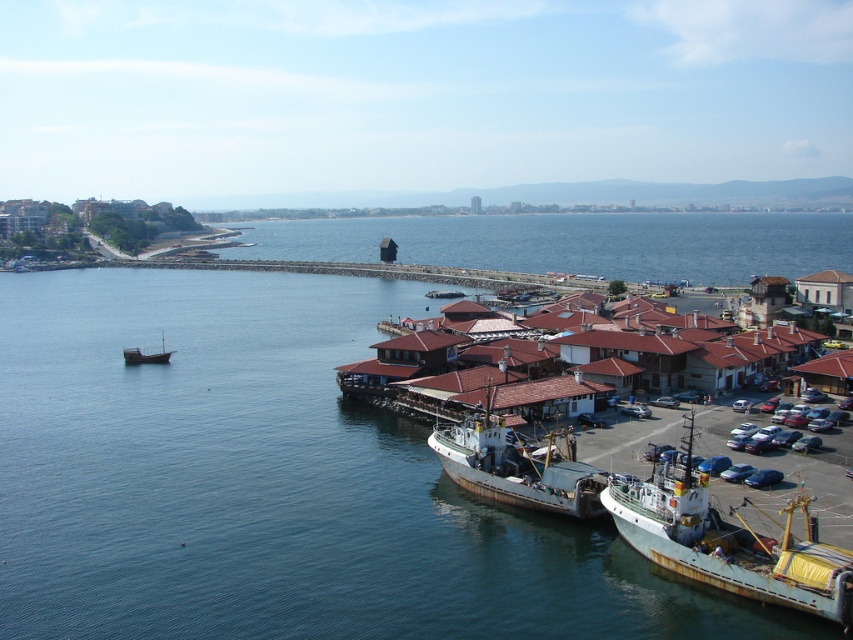
Is blue water at center to the left of rusty metal fishing boat at lower center from the viewer's perspective?

Correct, you'll find blue water at center to the left of rusty metal fishing boat at lower center.

The image size is (853, 640). Describe the element at coordinates (273, 483) in the screenshot. I see `blue water at center` at that location.

Does point (134, 563) come closer to viewer compared to point (456, 440)?

Yes, point (134, 563) is closer to viewer.

The image size is (853, 640). Identify the location of blue water at center. (273, 483).

Between rusty metal ship at lower right and wooden boat at left, which one is positioned higher?

wooden boat at left is above.

The width and height of the screenshot is (853, 640). I want to click on rusty metal ship at lower right, so click(730, 545).

Locate an element on the screen. The height and width of the screenshot is (640, 853). rusty metal ship at lower right is located at coordinates (730, 545).

Is blue water at center bigger than wooden boat at left?

Yes, blue water at center is bigger than wooden boat at left.

Can you confirm if blue water at center is positioned to the right of wooden boat at left?

Yes, blue water at center is to the right of wooden boat at left.

This screenshot has height=640, width=853. I want to click on blue water at center, so click(x=273, y=483).